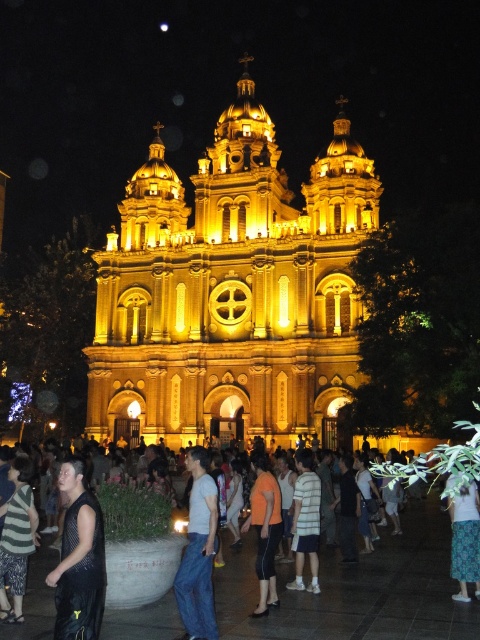
You are standing at the entrance of the church and want to approach both the matte black pants at lower center and the blue jeans at center. Which one should you walk towards first to reach the closer one?

You should walk towards the matte black pants at lower center first because it is closer to you than the blue jeans at center.

You are a photographer trying to capture a clear photo of the striped cotton shirt at center without the matte black pants at lower center blocking it. What should you do?

The matte black pants at lower center is in front of the striped cotton shirt at center, so you should move your position to the side or adjust your angle to avoid the obstruction caused by the matte black pants at lower center.

You are attending a night event at the church and notice two people in the crowd. One is wearing matte black pants at lower center and the other is wearing a striped cotton shirt at center. From your perspective, which clothing item is positioned more to the left?

The matte black pants at lower center are positioned to the left of the striped cotton shirt at center, so the matte black pants at lower center is more to the left.